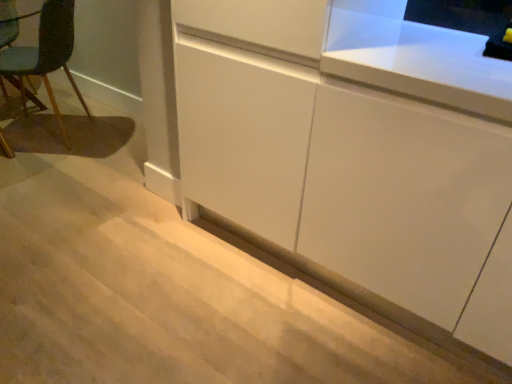
Question: Which direction should I rotate to look at white matte cabinet at center, positioned as the 1th cabinetry in right-to-left order?

Choices:
 (A) left
 (B) right

Answer: (B)

Question: Is white matte cabinet at lower center, which is counted as the first cabinetry, starting from the left, surrounded by white matte cabinet at center, which is counted as the 2th cabinetry, starting from the left?

Choices:
 (A) yes
 (B) no

Answer: (B)

Question: Is white matte cabinet at center, positioned as the 1th cabinetry in right-to-left order, thinner than white matte cabinet at lower center, the second cabinetry from the right?

Choices:
 (A) yes
 (B) no

Answer: (A)

Question: From a real-world perspective, is white matte cabinet at center, which is counted as the 2th cabinetry, starting from the left, physically below white matte cabinet at lower center, the second cabinetry from the right?

Choices:
 (A) no
 (B) yes

Answer: (A)

Question: From the image's perspective, does white matte cabinet at center, which is counted as the 2th cabinetry, starting from the left, appear higher than white matte cabinet at lower center, the second cabinetry from the right?

Choices:
 (A) no
 (B) yes

Answer: (B)

Question: Considering the relative positions of white matte cabinet at center, which is counted as the 2th cabinetry, starting from the left, and white matte cabinet at lower center, the second cabinetry from the right, in the image provided, is white matte cabinet at center, which is counted as the 2th cabinetry, starting from the left, to the right of white matte cabinet at lower center, the second cabinetry from the right, from the viewer's perspective?

Choices:
 (A) yes
 (B) no

Answer: (A)

Question: Does white matte cabinet at center, positioned as the 1th cabinetry in right-to-left order, appear on the left side of white matte cabinet at lower center, which is counted as the first cabinetry, starting from the left?

Choices:
 (A) yes
 (B) no

Answer: (B)

Question: Can you confirm if white matte cabinet at lower center, the second cabinetry from the right, is shorter than white matte cabinet at center, which is counted as the 2th cabinetry, starting from the left?

Choices:
 (A) yes
 (B) no

Answer: (A)

Question: Would you say white matte cabinet at lower center, the second cabinetry from the right, contains white matte cabinet at center, which is counted as the 2th cabinetry, starting from the left?

Choices:
 (A) no
 (B) yes

Answer: (A)

Question: Does white matte cabinet at lower center, which is counted as the first cabinetry, starting from the left, have a greater width compared to white matte cabinet at center, positioned as the 1th cabinetry in right-to-left order?

Choices:
 (A) yes
 (B) no

Answer: (A)

Question: Is white matte cabinet at lower center, the second cabinetry from the right, to the right of white matte cabinet at center, which is counted as the 2th cabinetry, starting from the left, from the viewer's perspective?

Choices:
 (A) no
 (B) yes

Answer: (A)

Question: Is white matte cabinet at lower center, the second cabinetry from the right, not near white matte cabinet at center, positioned as the 1th cabinetry in right-to-left order?

Choices:
 (A) no
 (B) yes

Answer: (A)

Question: Is white matte cabinet at lower center, the second cabinetry from the right, bigger than white matte cabinet at center, positioned as the 1th cabinetry in right-to-left order?

Choices:
 (A) no
 (B) yes

Answer: (A)

Question: Can you confirm if white matte cabinet at lower center, which is counted as the first cabinetry, starting from the left, is thinner than teal fabric chair at left?

Choices:
 (A) no
 (B) yes

Answer: (A)